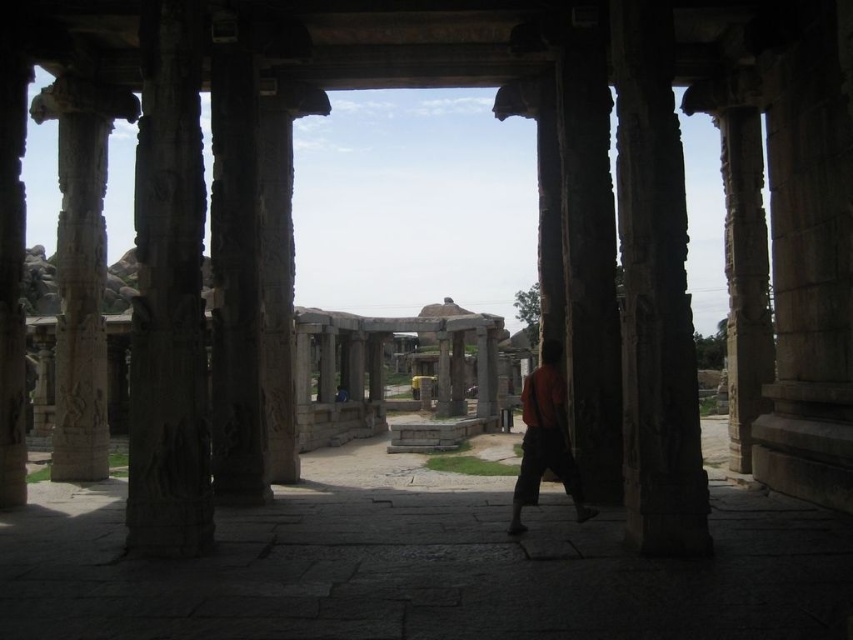
Question: Can you confirm if carved stone column at left is bigger than orange fabric at center?

Choices:
 (A) yes
 (B) no

Answer: (A)

Question: Can you confirm if carved stone column at left is wider than orange fabric at center?

Choices:
 (A) no
 (B) yes

Answer: (B)

Question: Does carved stone column at left appear over orange fabric at center?

Choices:
 (A) no
 (B) yes

Answer: (B)